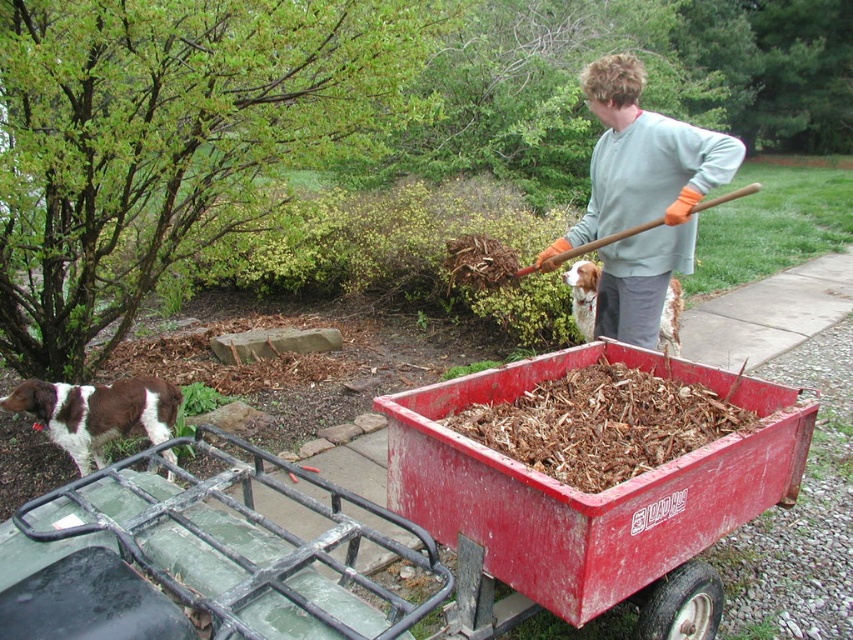
Which is below, red plastic cart at center or wooden shovel at upper right?

Positioned lower is red plastic cart at center.

Is red plastic cart at center positioned in front of wooden shovel at upper right?

Yes.

Based on the photo, who is more distant from viewer, (648, 360) or (598, 243)?

Positioned behind is point (598, 243).

This screenshot has height=640, width=853. Identify the location of red plastic cart at center. (438, 518).

Is brown and white fur at lower left shorter than brown speckled fur at center?

Yes, brown and white fur at lower left is shorter than brown speckled fur at center.

Consider the image. Who is lower down, brown and white fur at lower left or brown speckled fur at center?

brown and white fur at lower left is below.

Which is in front, point (48, 420) or point (668, 301)?

Point (48, 420) is more forward.

Where is `brown and white fur at lower left`? This screenshot has width=853, height=640. brown and white fur at lower left is located at coordinates (96, 413).

Is red plastic cart at center in front of brown speckled fur at center?

Yes, red plastic cart at center is in front of brown speckled fur at center.

Between point (265, 529) and point (578, 305), which one is positioned behind?

The point (578, 305) is behind.

Measure the distance between point (x=705, y=604) and camera.

The distance of point (x=705, y=604) from camera is 8.60 feet.

What are the coordinates of `red plastic cart at center` in the screenshot? It's located at (438, 518).